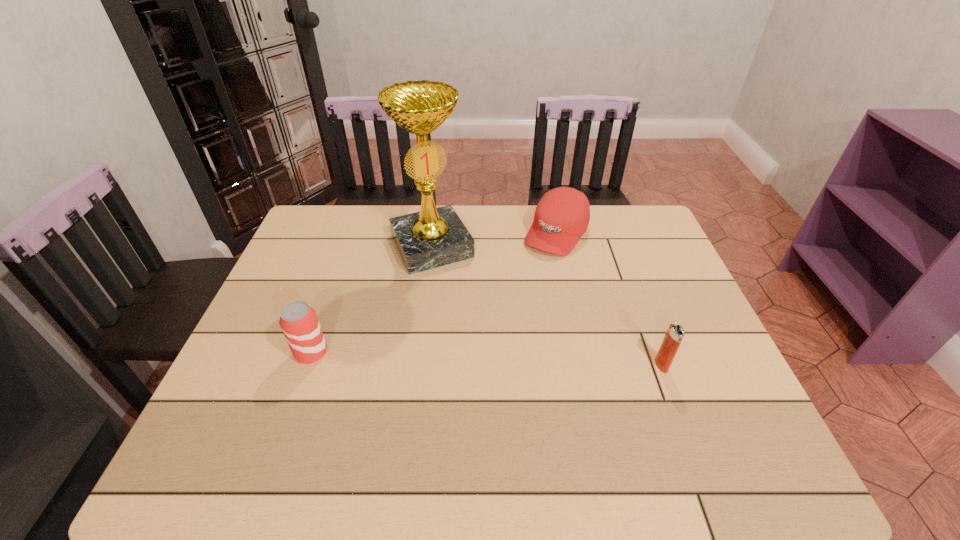
Locate an element on the screen. vacant space that is in between the igniter and the award is located at coordinates (547, 306).

Find the location of a particular element. This screenshot has width=960, height=540. empty space between the igniter and the beer can is located at coordinates (487, 359).

Identify the location of the closest object to the rightmost object. (562, 215).

Select which object is the third closest to the second object from right to left. Please provide its 2D coordinates. Your answer should be formatted as a tuple, i.e. [(x, y)], where the tuple contains the x and y coordinates of a point satisfying the conditions above.

[(298, 320)]

Where is `vacant space that satisfies the following two spatial constraints: 1. on the front side of the rightmost object; 2. on the left side of the cap`? vacant space that satisfies the following two spatial constraints: 1. on the front side of the rightmost object; 2. on the left side of the cap is located at coordinates (585, 365).